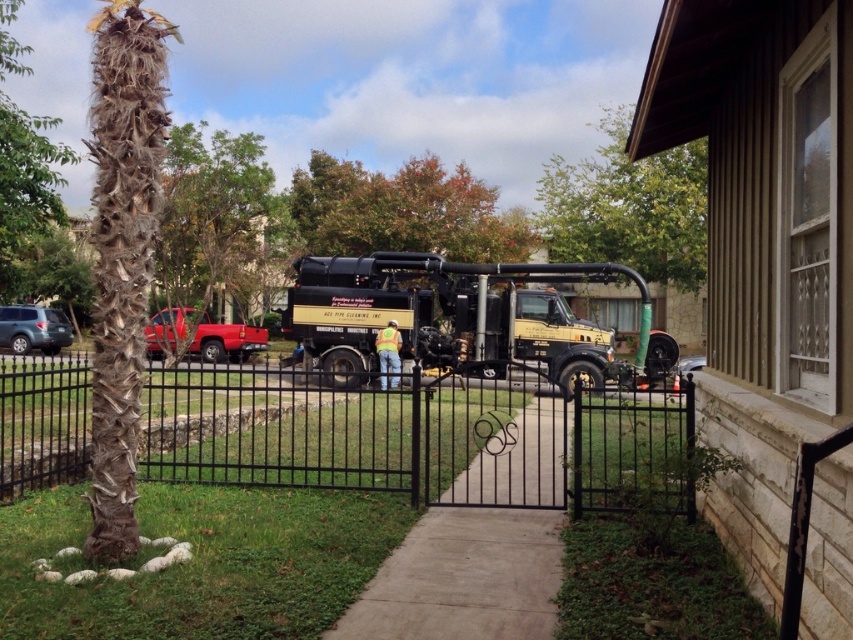
Question: Is the position of green leafy tree at upper center more distant than that of brown rough bark tree at upper left?

Choices:
 (A) no
 (B) yes

Answer: (B)

Question: Which point is farther from the camera taking this photo?

Choices:
 (A) (16, 410)
 (B) (566, 272)
 (C) (15, 340)

Answer: (C)

Question: Does brown/scaly palm tree at left have a lesser width compared to brown rough bark tree at upper left?

Choices:
 (A) yes
 (B) no

Answer: (A)

Question: Does gold metallic trailer truck at center appear under glossy red truck at left?

Choices:
 (A) no
 (B) yes

Answer: (A)

Question: Estimate the real-world distances between objects in this image. Which object is closer to the satin silver suv at lower left?

Choices:
 (A) gold metallic trailer truck at center
 (B) glossy red truck at left
 (C) brown rough bark tree at upper left
 (D) brown/scaly palm tree at left

Answer: (C)

Question: Which object is the closest to the satin silver suv at lower left?

Choices:
 (A) black metal gate at center
 (B) glossy red truck at left
 (C) brown/scaly palm tree at left

Answer: (B)